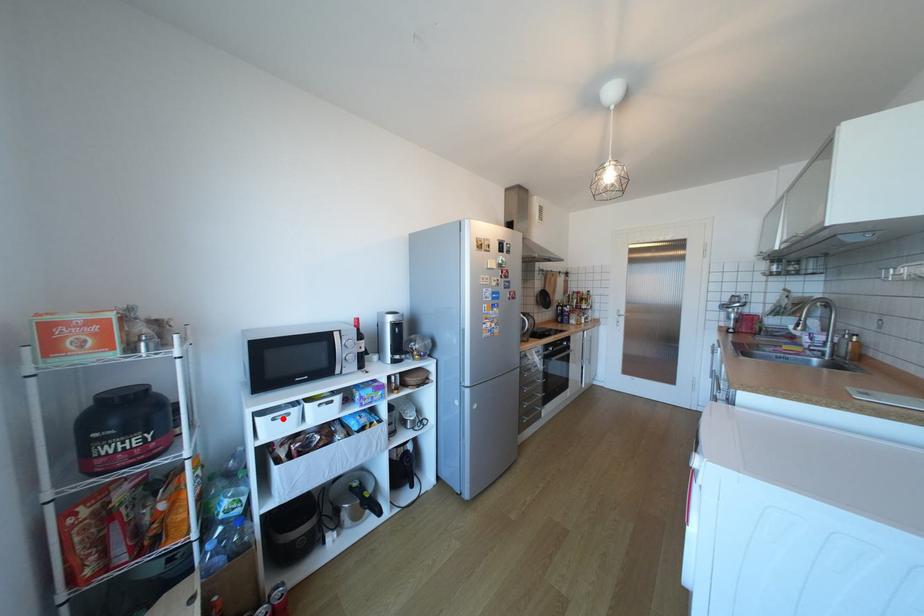
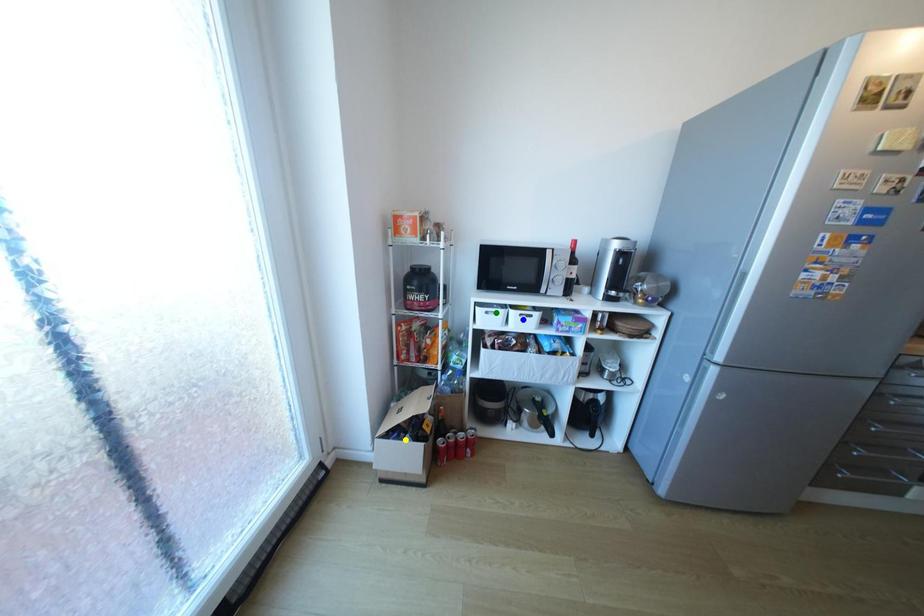
Question: I am providing you with two images of the same scene from different viewpoints. A red point is marked on the first image. You are given multiple points on the second image. Which spot in image 2 lines up with the point in image 1?

Choices:
 (A) blue point
 (B) green point
 (C) yellow point

Answer: (B)